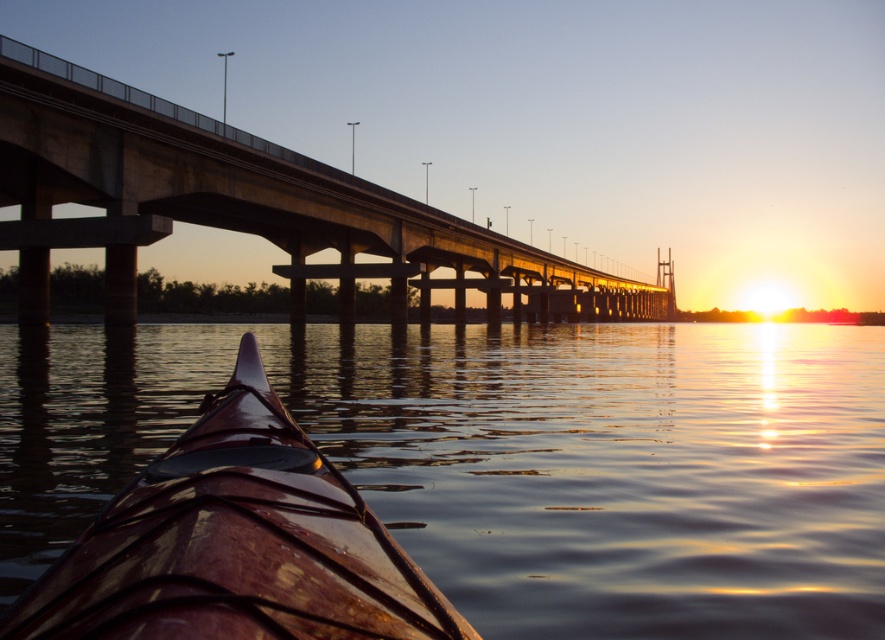
You are in a kayak and looking at the bridge. There are two points marked on the bridge, point 1 at coordinates point (x=168, y=150) and point 2 at coordinates point (x=183, y=561). Which point is closer to your kayak?

Point 1 at coordinates point (x=168, y=150) is closer to your kayak because it is further to the camera than point 2 at coordinates point (x=183, y=561).

You are in a kayak and want to position yourself directly under the concrete bridge at center. Given your current position, can you estimate whether you need to move left or right to reach the bridge?

The concrete bridge at center is located at coordinates approximately 0.320 on the x and 0.277 on the y axis. Since the kayak is in the foreground, you should move towards the center of the image to align with the bridge. Based on the coordinates, moving slightly to the right would position you under the bridge.